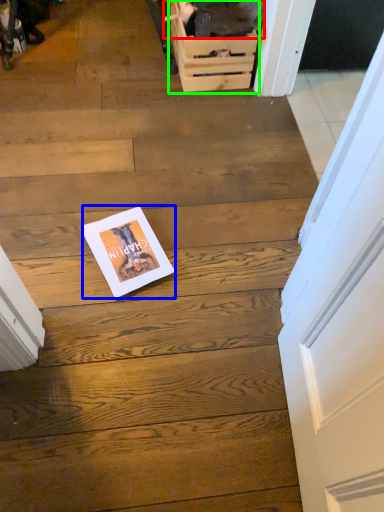
Question: Which object is the farthest from couple (highlighted by a red box)? Choose among these: magazine (highlighted by a blue box) or drawer (highlighted by a green box).

Choices:
 (A) magazine
 (B) drawer

Answer: (A)